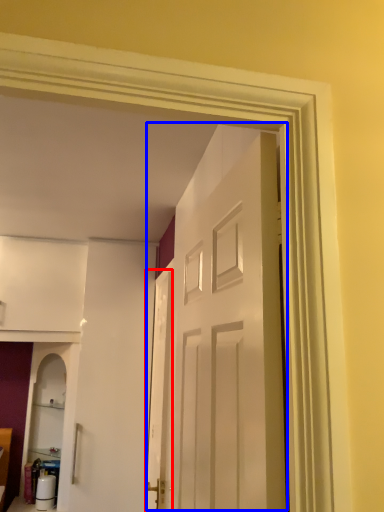
Question: Among these objects, which one is farthest to the camera, screen door (highlighted by a red box) or door (highlighted by a blue box)?

Choices:
 (A) screen door
 (B) door

Answer: (A)